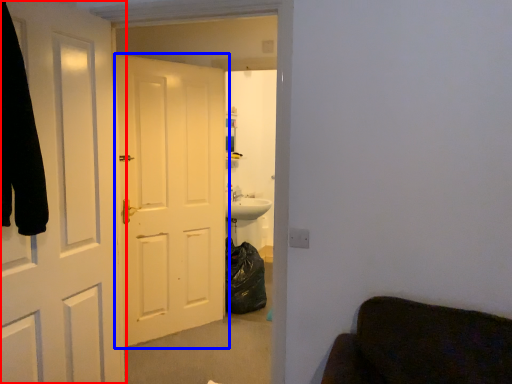
Question: Which object is further to the camera taking this photo, door (highlighted by a red box) or door (highlighted by a blue box)?

Choices:
 (A) door
 (B) door

Answer: (B)